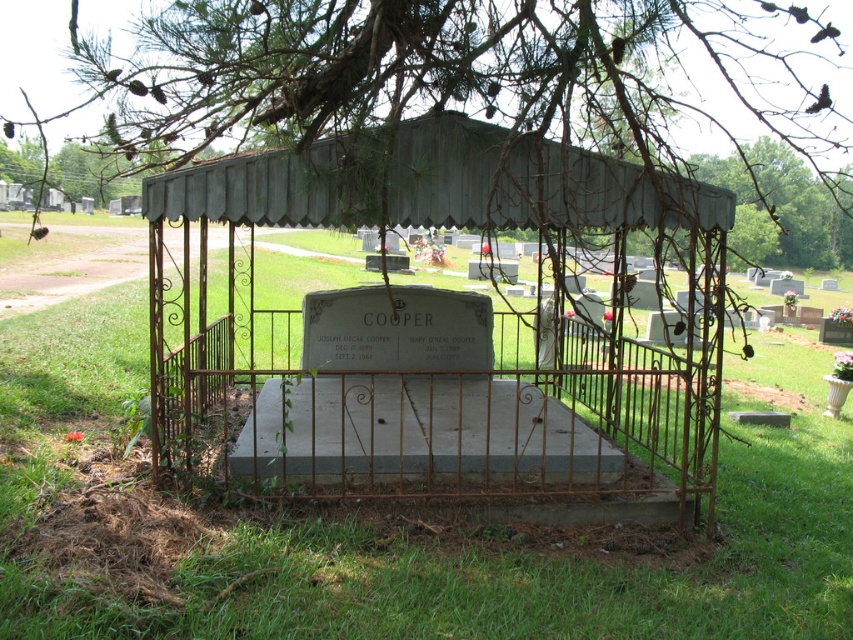
Question: Which point is closer to the camera?

Choices:
 (A) green leafy tree at upper center
 (B) metallic gray canopy at center
 (C) green grass at center
 (D) rusty metal gazebo at center

Answer: (C)

Question: Does green grass at center come in front of green leafy tree at upper center?

Choices:
 (A) yes
 (B) no

Answer: (A)

Question: Which point appears farthest from the camera in this image?

Choices:
 (A) (149, 529)
 (B) (595, 83)

Answer: (B)

Question: Is green leafy tree at upper center positioned in front of metallic gray canopy at center?

Choices:
 (A) no
 (B) yes

Answer: (A)

Question: Does green grass at center have a lesser width compared to metallic gray canopy at center?

Choices:
 (A) yes
 (B) no

Answer: (B)

Question: Estimate the real-world distances between objects in this image. Which object is closer to the green leafy tree at upper center?

Choices:
 (A) green grass at center
 (B) metallic gray canopy at center

Answer: (B)